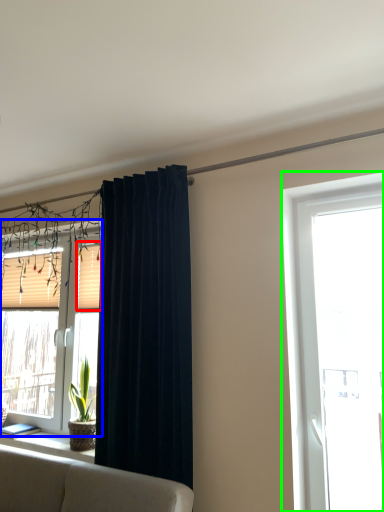
Question: Based on their relative distances, which object is farther from shutter (highlighted by a red box)? Choose from window (highlighted by a blue box) and window (highlighted by a green box).

Choices:
 (A) window
 (B) window

Answer: (B)